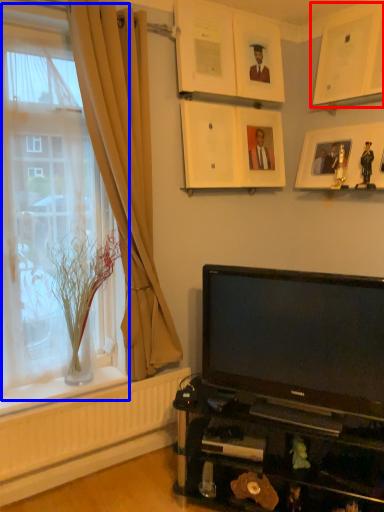
Question: Which point is further to the camera, picture frame (highlighted by a red box) or window (highlighted by a blue box)?

Choices:
 (A) picture frame
 (B) window

Answer: (A)